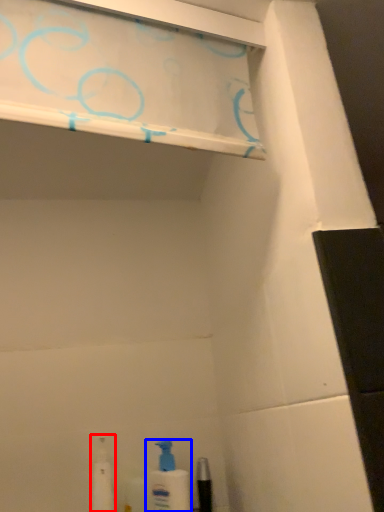
Question: Which point is further to the camera, toiletry (highlighted by a red box) or cleaning product (highlighted by a blue box)?

Choices:
 (A) toiletry
 (B) cleaning product

Answer: (B)